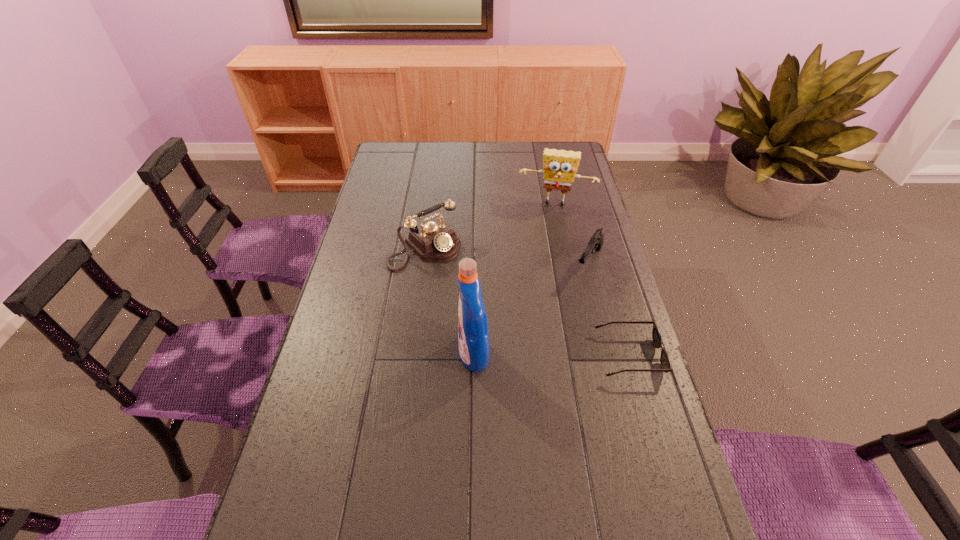
Identify the location of vacant space located 0.320m on the label of the tallest object. This screenshot has width=960, height=540. (342, 355).

This screenshot has width=960, height=540. I want to click on vacant space located 0.300m on the dial of the telephone, so click(504, 321).

Where is `vacant space located on the dial of the telephone`? This screenshot has height=540, width=960. vacant space located on the dial of the telephone is located at coordinates (464, 284).

Locate an element on the screen. vacant area located on the dial of the telephone is located at coordinates (509, 326).

Where is `vacant space located on the face of the sponge`? Image resolution: width=960 pixels, height=540 pixels. vacant space located on the face of the sponge is located at coordinates (540, 262).

Where is `vacant area situated 0.290m on the face of the sponge`? The image size is (960, 540). vacant area situated 0.290m on the face of the sponge is located at coordinates (540, 262).

You are a GUI agent. You are given a task and a screenshot of the screen. Output one action in this format:
    pyautogui.click(x=<x>, y=<y>)
    Task: Click on the vacant region located on the face of the sponge
    This screenshot has width=960, height=540.
    Given the screenshot: What is the action you would take?
    pyautogui.click(x=537, y=278)

I want to click on free space located at the end of the barrel of the fourth tallest object, so click(540, 354).

You are a GUI agent. You are given a task and a screenshot of the screen. Output one action in this format:
    pyautogui.click(x=<x>, y=<y>)
    Task: Click on the vacant space located 0.100m at the end of the barrel of the fourth tallest object
    
    Given the screenshot: What is the action you would take?
    pyautogui.click(x=572, y=301)

You are a GUI agent. You are given a task and a screenshot of the screen. Output one action in this format:
    pyautogui.click(x=<x>, y=<y>)
    Task: Click on the vacant point located 0.350m at the end of the barrel of the fourth tallest object
    This screenshot has width=960, height=540.
    Given the screenshot: What is the action you would take?
    pyautogui.click(x=538, y=359)